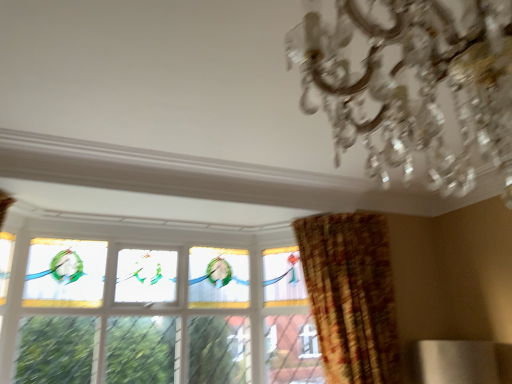
Question: Considering the relative sizes of clear crystal chandelier at upper right and plaid fabric curtain at right in the image provided, is clear crystal chandelier at upper right smaller than plaid fabric curtain at right?

Choices:
 (A) no
 (B) yes

Answer: (B)

Question: From a real-world perspective, does clear crystal chandelier at upper right sit lower than plaid fabric curtain at right?

Choices:
 (A) yes
 (B) no

Answer: (B)

Question: Is clear crystal chandelier at upper right bigger than plaid fabric curtain at right?

Choices:
 (A) no
 (B) yes

Answer: (A)

Question: Could you tell me if clear crystal chandelier at upper right is facing plaid fabric curtain at right?

Choices:
 (A) no
 (B) yes

Answer: (A)

Question: Is clear crystal chandelier at upper right not within plaid fabric curtain at right?

Choices:
 (A) no
 (B) yes

Answer: (B)

Question: From a real-world perspective, relative to plaid fabric curtain at right, is clear crystal chandelier at upper right vertically above or below?

Choices:
 (A) below
 (B) above

Answer: (B)

Question: From their relative heights in the image, would you say clear crystal chandelier at upper right is taller or shorter than plaid fabric curtain at right?

Choices:
 (A) short
 (B) tall

Answer: (A)

Question: Is clear crystal chandelier at upper right inside or outside of plaid fabric curtain at right?

Choices:
 (A) outside
 (B) inside

Answer: (A)

Question: Visually, is clear crystal chandelier at upper right positioned to the left or to the right of plaid fabric curtain at right?

Choices:
 (A) right
 (B) left

Answer: (B)

Question: Considering the positions of plaid fabric curtain at right and clear crystal chandelier at upper right in the image, is plaid fabric curtain at right taller or shorter than clear crystal chandelier at upper right?

Choices:
 (A) tall
 (B) short

Answer: (A)

Question: From a real-world perspective, is plaid fabric curtain at right positioned above or below clear crystal chandelier at upper right?

Choices:
 (A) below
 (B) above

Answer: (A)

Question: Does point (385, 254) appear closer or farther from the camera than point (313, 13)?

Choices:
 (A) closer
 (B) farther

Answer: (B)

Question: Relative to clear crystal chandelier at upper right, is plaid fabric curtain at right in front or behind?

Choices:
 (A) behind
 (B) front

Answer: (A)

Question: Would you say plaid fabric curtain at right is inside or outside stained glass window at center?

Choices:
 (A) inside
 (B) outside

Answer: (B)

Question: Based on their positions, is plaid fabric curtain at right located to the left or right of stained glass window at center?

Choices:
 (A) right
 (B) left

Answer: (A)